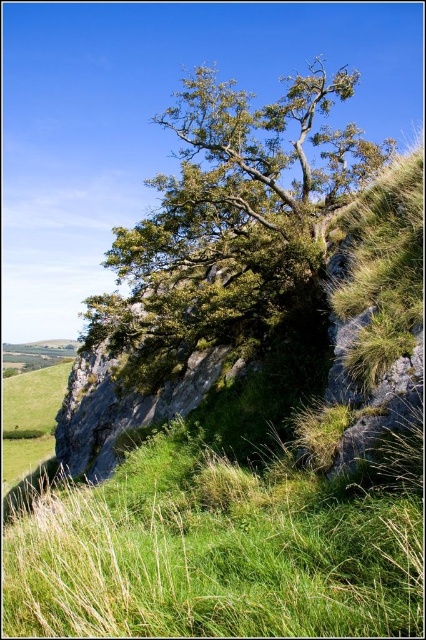
You are a hiker who wants to take a photo of the green leafy tree at upper center. You are currently standing on the green grassy at lower left. Which direction should you move to get a better view of the tree?

The green grassy at lower left is not as tall as the green leafy tree at upper center, so moving towards the upper center direction from the green grassy at lower left will provide a better view of the tree.

In the scene shown: You are a hiker planning to cross the area shown in the image. You need to know which area is narrower between the green grassy at lower left and the green leafy tree at upper center. Which one should you choose if you want to take the narrower path?

The green grassy at lower left has a lesser width compared to the green leafy tree at upper center, so you should choose the green grassy at lower left for the narrower path.